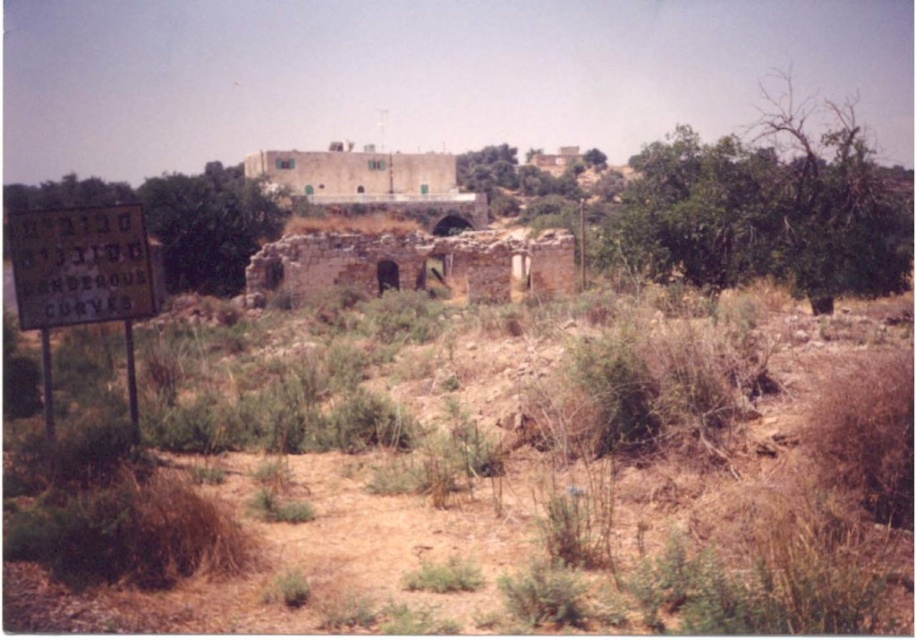
Does brown dry grass at lower center appear on the left side of yellow paper sign at left?

Incorrect, brown dry grass at lower center is not on the left side of yellow paper sign at left.

Can you confirm if brown dry grass at lower center is shorter than yellow paper sign at left?

Incorrect, brown dry grass at lower center's height does not fall short of yellow paper sign at left's.

At what (x,y) coordinates should I click in order to perform the action: click on brown dry grass at lower center. Please return your answer as a coordinate pair (x, y). The height and width of the screenshot is (640, 916). Looking at the image, I should click on (487, 483).